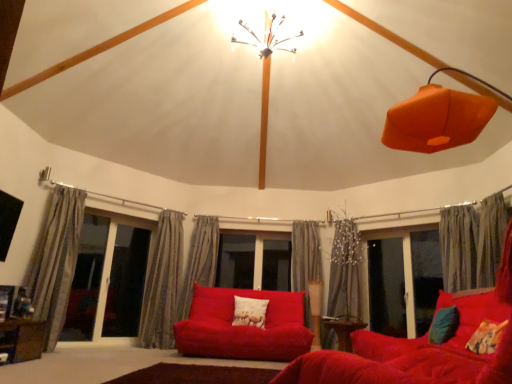
Question: Is wooden table at lower center, acting as the first table starting from the bottom, smaller than brown wooden table at lower left, which appears as the first table when viewed from the left?

Choices:
 (A) no
 (B) yes

Answer: (B)

Question: Is wooden table at lower center, acting as the first table starting from the bottom, outside of brown wooden table at lower left, the second table when ordered from right to left?

Choices:
 (A) yes
 (B) no

Answer: (A)

Question: Can you confirm if wooden table at lower center, which is the second table from front to back, is positioned to the right of brown wooden table at lower left, which appears as the first table when viewed from the left?

Choices:
 (A) yes
 (B) no

Answer: (A)

Question: Is wooden table at lower center, acting as the second table starting from the top, positioned far away from brown wooden table at lower left, arranged as the 2th table when viewed from the back?

Choices:
 (A) yes
 (B) no

Answer: (A)

Question: Is wooden table at lower center, which is the second table in left-to-right order, positioned with its back to brown wooden table at lower left, the first table when ordered from front to back?

Choices:
 (A) no
 (B) yes

Answer: (A)

Question: Choose the correct answer: Is gray textured curtain at center, the 2th curtain viewed from the left, inside fluffy multicolored pillow at lower right, placed as the 2th pillow when sorted from right to left, or outside it?

Choices:
 (A) outside
 (B) inside

Answer: (A)

Question: From the image's perspective, is gray textured curtain at center, placed as the sixth curtain when sorted from right to left, located above or below fluffy multicolored pillow at lower right, which appears as the second pillow when viewed from the left?

Choices:
 (A) below
 (B) above

Answer: (A)

Question: From a real-world perspective, is gray textured curtain at center, placed as the sixth curtain when sorted from right to left, above or below fluffy multicolored pillow at lower right, which appears as the second pillow when viewed from the left?

Choices:
 (A) above
 (B) below

Answer: (A)

Question: Considering the positions of gray textured curtain at center, placed as the sixth curtain when sorted from right to left, and fluffy multicolored pillow at lower right, which appears as the second pillow when viewed from the left, in the image, is gray textured curtain at center, placed as the sixth curtain when sorted from right to left, wider or thinner than fluffy multicolored pillow at lower right, which appears as the second pillow when viewed from the left,?

Choices:
 (A) wide
 (B) thin

Answer: (A)

Question: From the image's perspective, is white textured pillow at center, marked as the third pillow in a right-to-left arrangement, above or below transparent glass window at right?

Choices:
 (A) above
 (B) below

Answer: (B)

Question: From a real-world perspective, is white textured pillow at center, the first pillow in the back-to-front sequence, physically located above or below transparent glass window at right?

Choices:
 (A) below
 (B) above

Answer: (A)

Question: In terms of size, does white textured pillow at center, marked as the third pillow in a right-to-left arrangement, appear bigger or smaller than transparent glass window at right?

Choices:
 (A) big
 (B) small

Answer: (B)

Question: Is white textured pillow at center, the third pillow from the front, in front of or behind transparent glass window at right in the image?

Choices:
 (A) behind
 (B) front

Answer: (A)

Question: From a real-world perspective, is wooden table at lower center, acting as the first table starting from the bottom, above or below gray textured curtain at center, which is counted as the 4th curtain, starting from the left?

Choices:
 (A) below
 (B) above

Answer: (A)

Question: Is wooden table at lower center, which is the second table from front to back, spatially inside gray textured curtain at center, which is counted as the 4th curtain, starting from the left, or outside of it?

Choices:
 (A) outside
 (B) inside

Answer: (A)